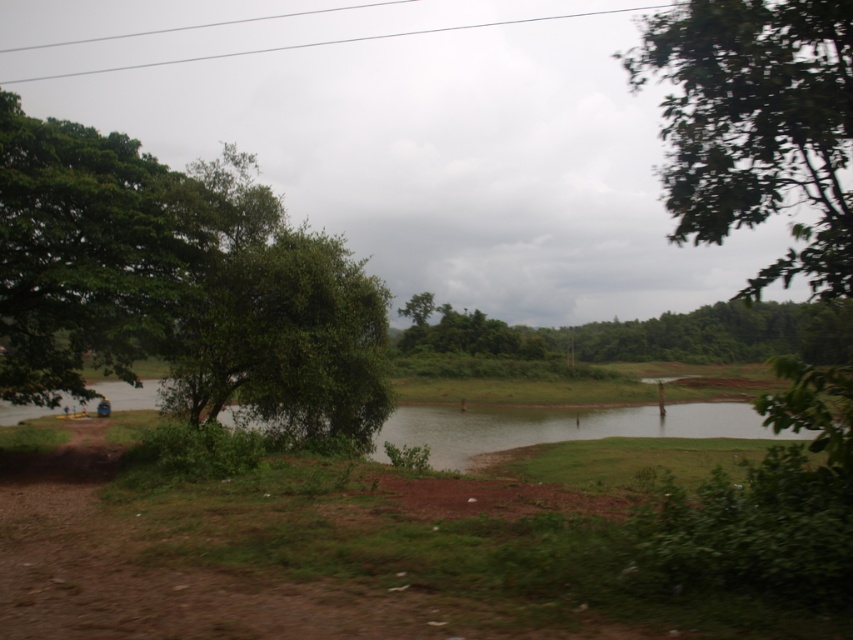
Question: Which object is positioned closest to the green leafy tree at upper right?

Choices:
 (A) green leafy trees at center
 (B) green leafy tree at left

Answer: (B)

Question: Among these points, which one is farthest from the camera?

Choices:
 (A) (136, 193)
 (B) (850, 192)

Answer: (A)

Question: Observing the image, what is the correct spatial positioning of green leafy tree at left in reference to green leafy tree at upper right?

Choices:
 (A) left
 (B) right

Answer: (A)

Question: Can you confirm if green leafy tree at upper right is bigger than green leafy trees at center?

Choices:
 (A) yes
 (B) no

Answer: (A)

Question: Is green leafy tree at upper right further to camera compared to green leafy trees at center?

Choices:
 (A) yes
 (B) no

Answer: (B)

Question: Estimate the real-world distances between objects in this image. Which object is closer to the green leafy tree at upper right?

Choices:
 (A) green leafy trees at center
 (B) green leafy tree at left

Answer: (B)